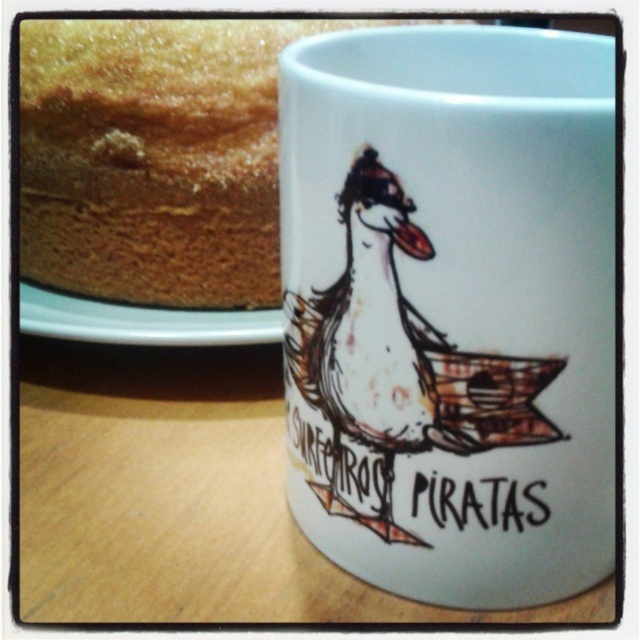
You are setting up a table for a tea party and need to place the white matte mug at upper center and the white glossy plate at upper left. According to the image, which item is closer to you?

The white matte mug at upper center is closer to you since it is in front of the white glossy plate at upper left.

You are a barista preparing drinks and need to place the white matte mug at upper center and the white glossy plate at upper left on a shelf. The shelf has a height limit of 12 inches. Can both items fit vertically on the shelf without exceeding the height limit?

The white matte mug at upper center is much taller than the white glossy plate at upper left. Since the shelf has a height limit of 12 inches, both items can fit vertically as the mug, being the taller one, is still within the height limit.

You are taking a photo of the ceramic mug and the cake in the background. Which point, point (x=544, y=262) or point (x=273, y=330), is closer to the camera?

Point (x=544, y=262) is closer to the camera than point (x=273, y=330).